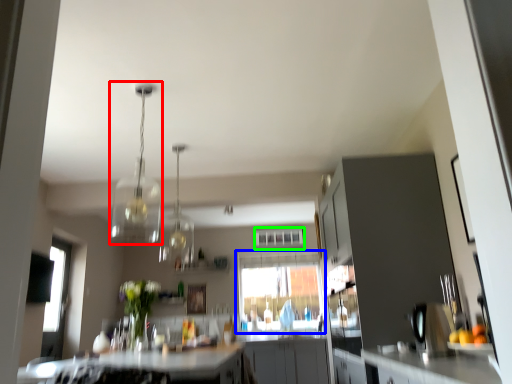
Question: Which is farther away from light fixture (highlighted by a red box)? window (highlighted by a blue box) or window (highlighted by a green box)?

Choices:
 (A) window
 (B) window

Answer: (A)